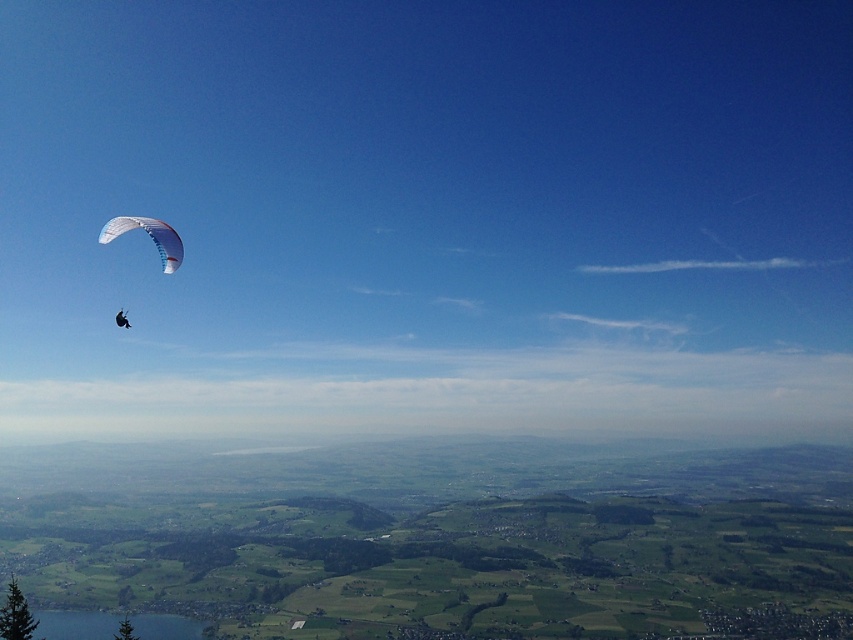
Question: From the image, what is the correct spatial relationship of white mesh parachute at left in relation to white fabric parachute at upper left?

Choices:
 (A) below
 (B) above

Answer: (B)

Question: Which point is closer to the camera taking this photo?

Choices:
 (A) (117, 324)
 (B) (163, 272)

Answer: (A)

Question: Is white mesh parachute at left below white fabric parachute at upper left?

Choices:
 (A) no
 (B) yes

Answer: (A)

Question: Which of the following is the closest to the observer?

Choices:
 (A) white mesh parachute at left
 (B) white fabric parachute at upper left

Answer: (A)

Question: Can you confirm if white mesh parachute at left is positioned below white fabric parachute at upper left?

Choices:
 (A) yes
 (B) no

Answer: (B)